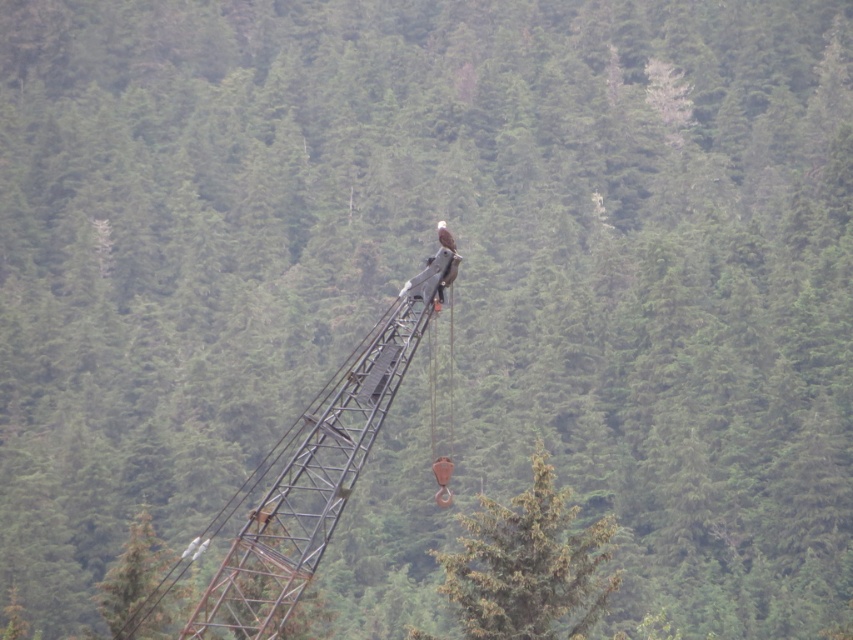
Which is below, rusty metal crane at center or green matte tree at center?

green matte tree at center is lower down.

Between rusty metal crane at center and green matte tree at center, which one appears on the right side from the viewer's perspective?

green matte tree at center is more to the right.

I want to click on rusty metal crane at center, so click(x=305, y=477).

This screenshot has width=853, height=640. Identify the location of rusty metal crane at center. (305, 477).